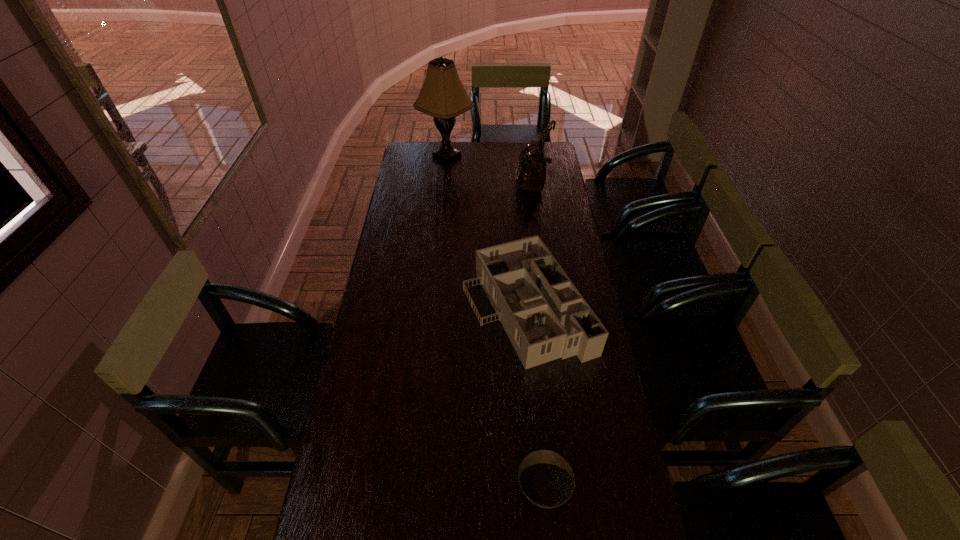
The height and width of the screenshot is (540, 960). Identify the location of the farthest object. tap(442, 96).

Where is `the tallest object`? the tallest object is located at coordinates (442, 96).

Where is `the second farthest object`? The height and width of the screenshot is (540, 960). the second farthest object is located at coordinates (531, 169).

Where is `shoulder bag`? This screenshot has width=960, height=540. shoulder bag is located at coordinates (531, 169).

Identify the location of the third tallest object. The height and width of the screenshot is (540, 960). (545, 317).

Find the location of a particular element. The width and height of the screenshot is (960, 540). the third farthest object is located at coordinates (545, 317).

Locate an element on the screen. The image size is (960, 540). the nearest object is located at coordinates (547, 480).

Identify the location of the shortest object. (547, 480).

The width and height of the screenshot is (960, 540). What are the coordinates of `free space located 0.090m on the right of the lamp` in the screenshot? It's located at (492, 156).

This screenshot has height=540, width=960. I want to click on vacant position located 0.100m on the front-facing side of the second farthest object, so click(496, 190).